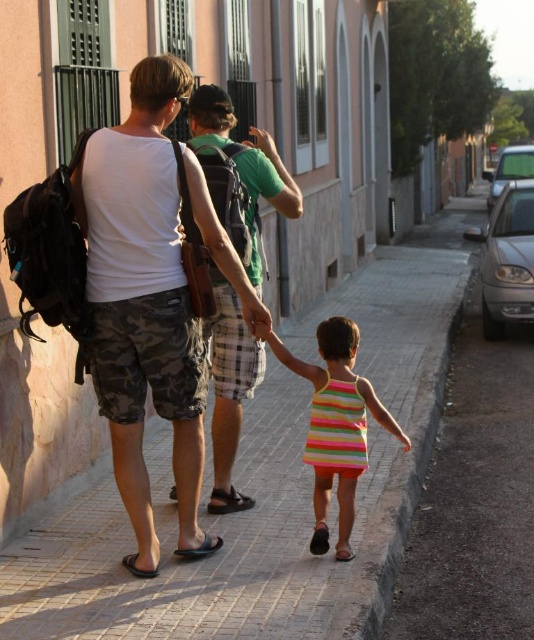
Question: Estimate the real-world distances between objects in this image. Which object is farther from the white matte tank top at center?

Choices:
 (A) paved stone sidewalk at center
 (B) black leather sandal at lower center
 (C) black leather sandal at lower left

Answer: (A)

Question: Can you confirm if striped fabric dress at center is smaller than black leather sandal at lower center?

Choices:
 (A) yes
 (B) no

Answer: (B)

Question: Does paved stone sidewalk at center come in front of black leather sandal at lower left?

Choices:
 (A) no
 (B) yes

Answer: (B)

Question: Does paved stone sidewalk at center appear under camouflage shorts at center?

Choices:
 (A) no
 (B) yes

Answer: (B)

Question: Among these objects, which one is farthest from the camera?

Choices:
 (A) striped fabric dress at center
 (B) white matte tank top at center
 (C) paved stone sidewalk at center

Answer: (A)

Question: Which point is farther to the camera?

Choices:
 (A) (255, 288)
 (B) (318, 381)
 (C) (153, 573)
 (D) (147, 205)

Answer: (A)